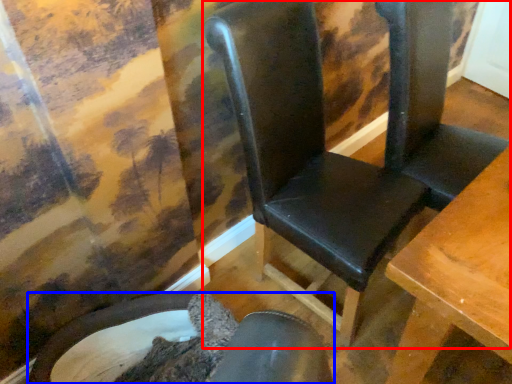
Question: Which object appears farthest to the camera in this image, chair (highlighted by a red box) or chair (highlighted by a blue box)?

Choices:
 (A) chair
 (B) chair

Answer: (B)